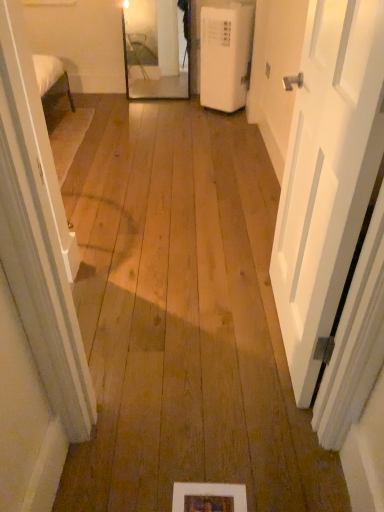
Question: Can you confirm if white matte door at right is shorter than wooden picture frame at lower center?

Choices:
 (A) no
 (B) yes

Answer: (A)

Question: Is white matte door at right further to the viewer compared to wooden picture frame at lower center?

Choices:
 (A) yes
 (B) no

Answer: (B)

Question: Does white matte door at right contain wooden picture frame at lower center?

Choices:
 (A) no
 (B) yes

Answer: (A)

Question: From a real-world perspective, is white matte door at right under wooden picture frame at lower center?

Choices:
 (A) no
 (B) yes

Answer: (A)

Question: From the image's perspective, is white matte door at right located beneath wooden picture frame at lower center?

Choices:
 (A) yes
 (B) no

Answer: (B)

Question: Considering the relative positions of white matte door at right and wooden picture frame at lower center in the image provided, is white matte door at right to the right of wooden picture frame at lower center from the viewer's perspective?

Choices:
 (A) no
 (B) yes

Answer: (B)

Question: From a real-world perspective, is white matte door at right over white plastic air conditioner at right?

Choices:
 (A) no
 (B) yes

Answer: (B)

Question: Is white matte door at right far from white plastic air conditioner at right?

Choices:
 (A) yes
 (B) no

Answer: (A)

Question: Could you tell me if white matte door at right is turned towards white plastic air conditioner at right?

Choices:
 (A) no
 (B) yes

Answer: (A)

Question: Is white matte door at right to the left of white plastic air conditioner at right from the viewer's perspective?

Choices:
 (A) no
 (B) yes

Answer: (A)

Question: Considering the relative sizes of white matte door at right and white plastic air conditioner at right in the image provided, is white matte door at right taller than white plastic air conditioner at right?

Choices:
 (A) yes
 (B) no

Answer: (A)

Question: From the image's perspective, is white matte door at right located above white plastic air conditioner at right?

Choices:
 (A) no
 (B) yes

Answer: (A)

Question: Can you confirm if white plastic air conditioner at right is wider than wooden picture frame at lower center?

Choices:
 (A) yes
 (B) no

Answer: (A)